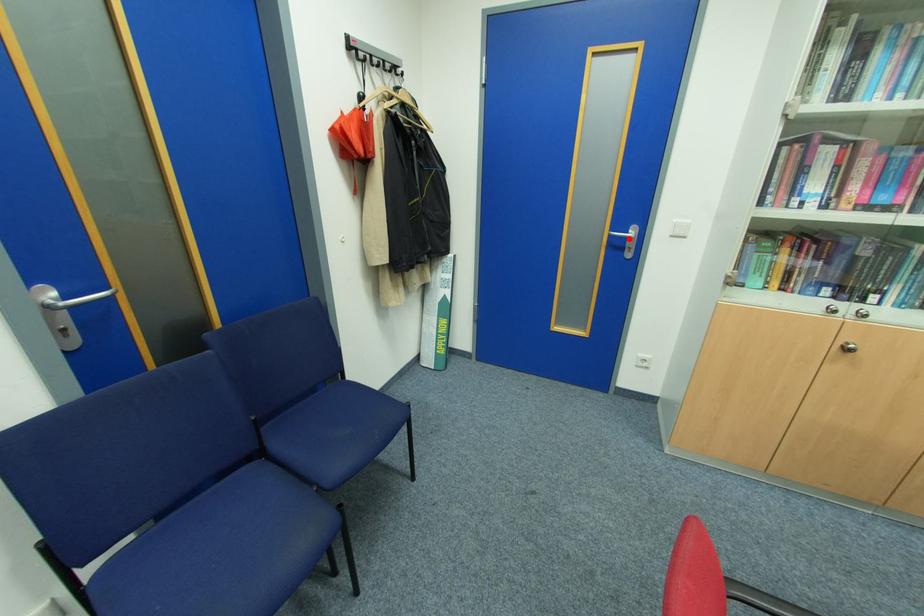
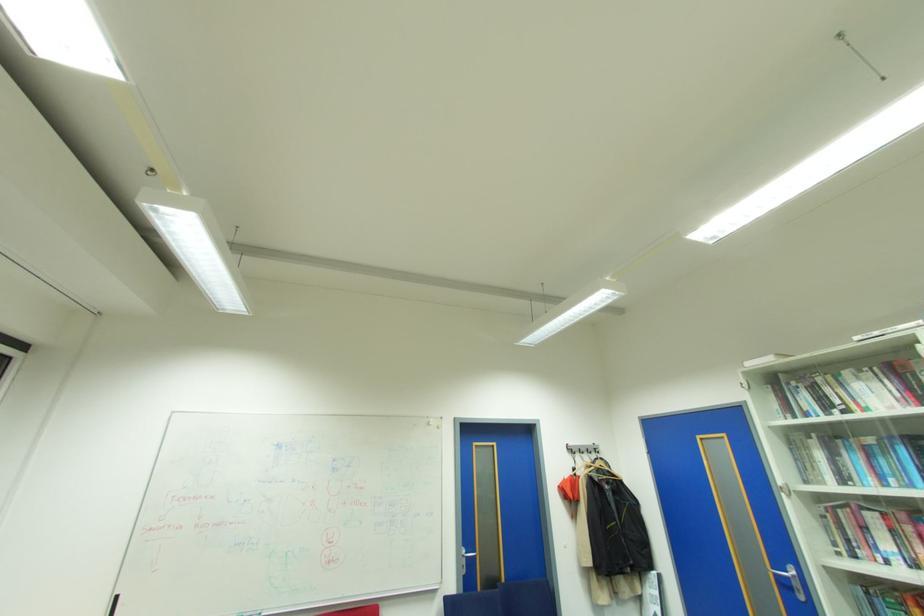
Question: A red point is marked in image1. In image2, is the corresponding 3D point closer to the camera or farther? Reply with the corresponding letter.

Choices:
 (A) The corresponding 3D point is closer.
 (B) The corresponding 3D point is farther.

Answer: (A)